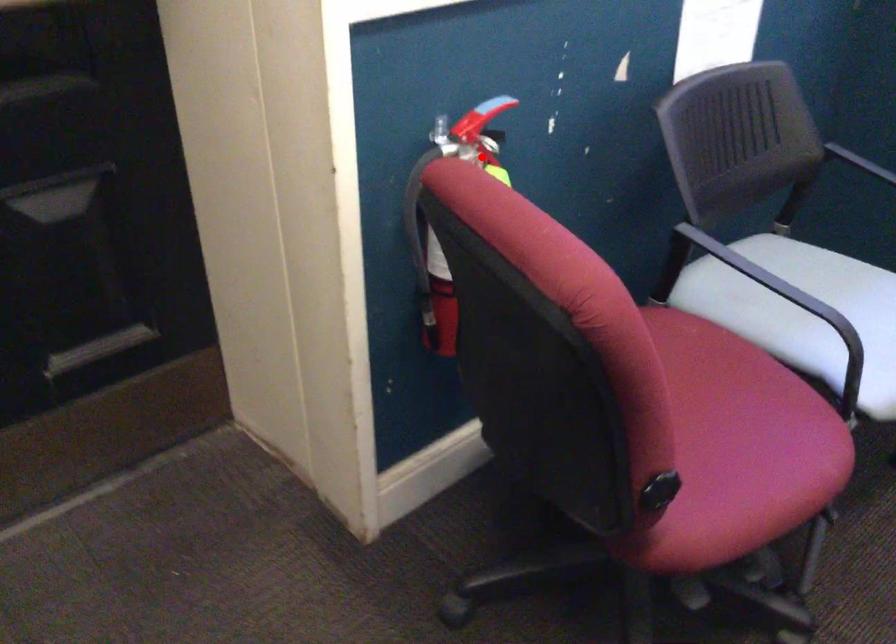
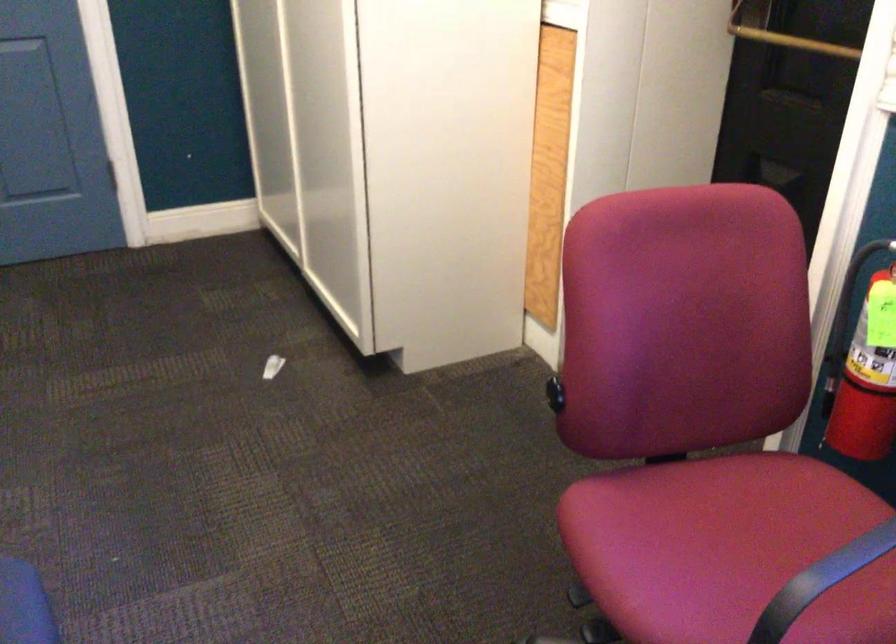
Where in the second image is the point corresponding to the highlighted location from the first image?

(892, 269)